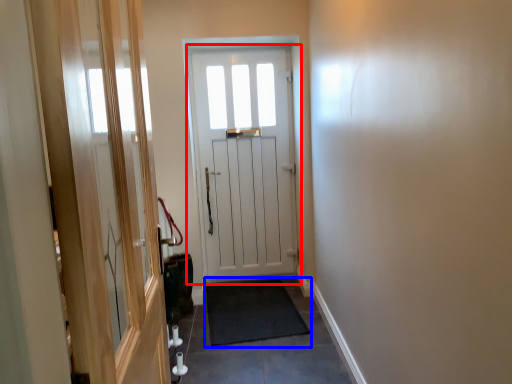
Question: Which of the following is the closest to the observer, door (highlighted by a red box) or doormat (highlighted by a blue box)?

Choices:
 (A) door
 (B) doormat

Answer: (B)